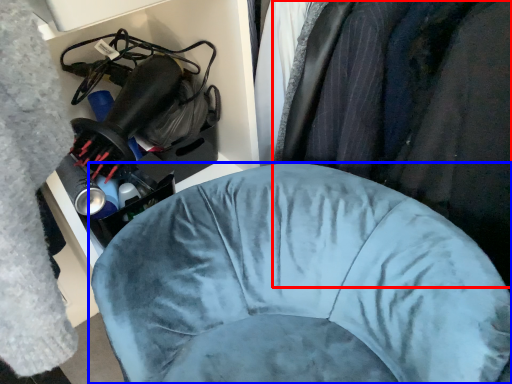
Question: Which of the following is the closest to the observer, clothing (highlighted by a red box) or furniture (highlighted by a blue box)?

Choices:
 (A) clothing
 (B) furniture

Answer: (A)